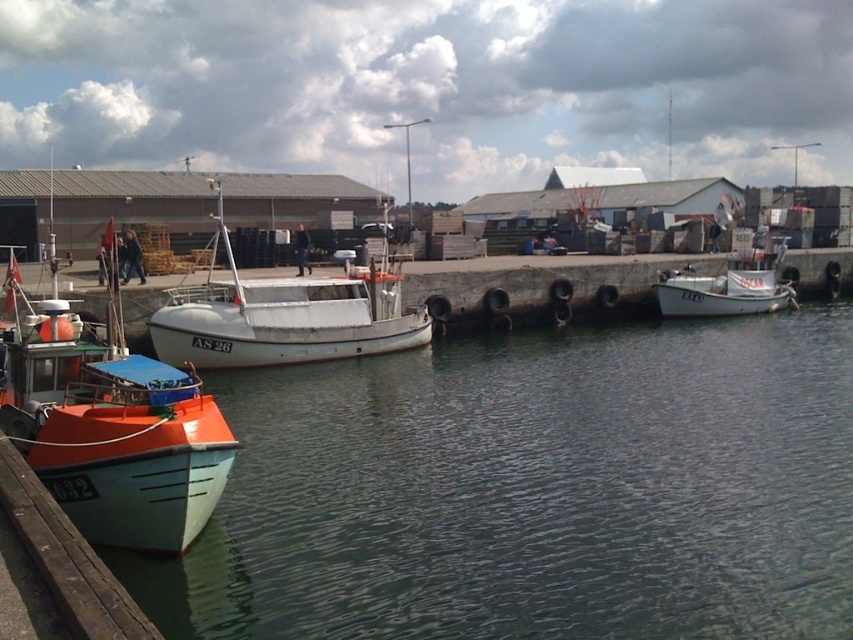
In the scene shown: You are standing at the point labeled point (180, 492) and want to walk to the point labeled point (660, 298). Which direction should you face to move directly towards your destination?

You should face north to move directly towards point (660, 298) from point (180, 492) because the destination is north of the starting point.

You are standing on the pier and see the small orange and white boat labeled AS 26 on the left and the white matte boat at center. Which boat is closer to you?

The white matte boat at center is closer to you because it is located at point [283,317], which is closer to the observer compared to the orange and white boat on the left.